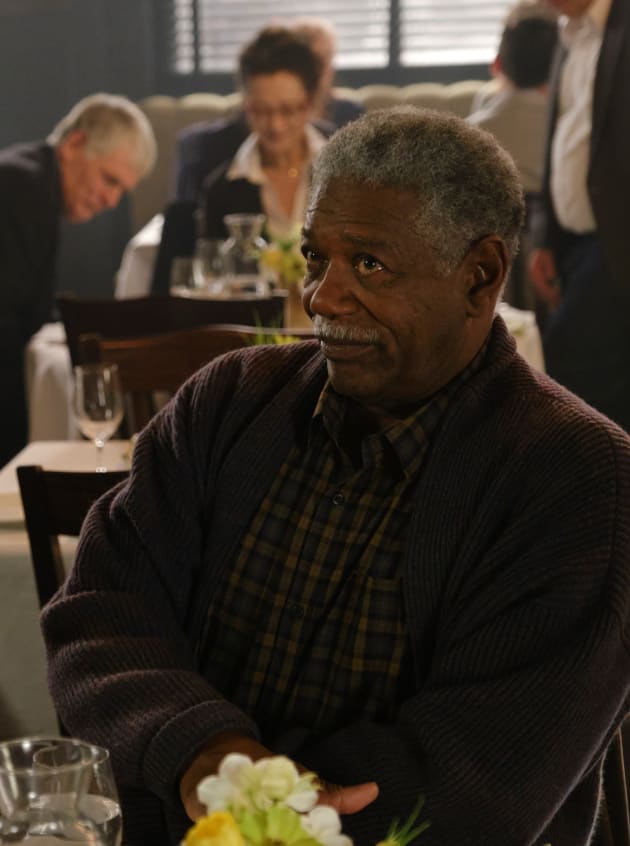
Where is `wine glass`? Image resolution: width=630 pixels, height=846 pixels. wine glass is located at coordinates (87, 782).